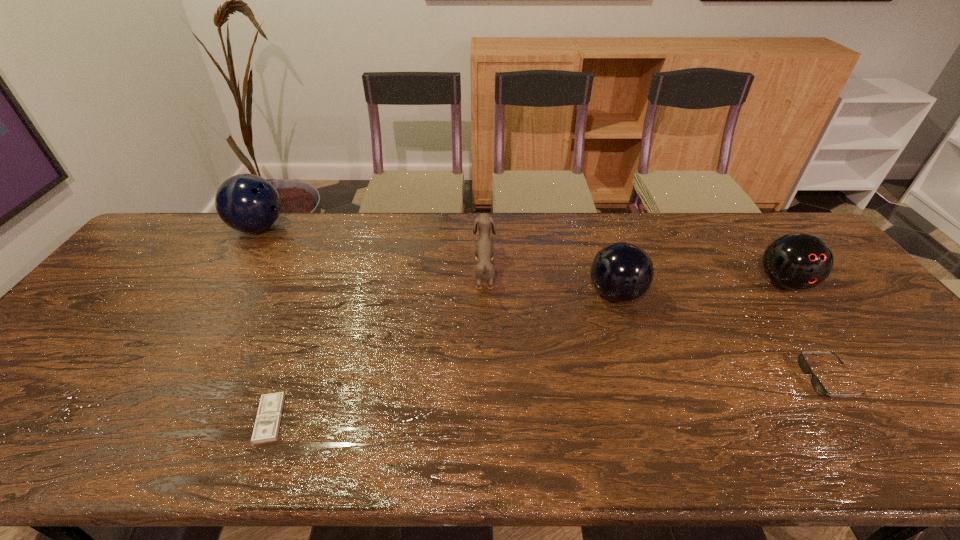
Identify which bowling ball is the nearest to the money. Please provide its 2D coordinates. Your answer should be formatted as a tuple, i.e. [(x, y)], where the tuple contains the x and y coordinates of a point satisfying the conditions above.

[(248, 203)]

Image resolution: width=960 pixels, height=540 pixels. In order to click on bowling ball that stands as the second closest to the third object from left to right in this screenshot , I will do `click(248, 203)`.

This screenshot has width=960, height=540. Identify the location of free spot that satisfies the following two spatial constraints: 1. on the side of the fourth object from left to right with the finger holes; 2. on the front side of the fifth object from right to left. (657, 419).

Identify the location of free space that satisfies the following two spatial constraints: 1. on the surface of the rightmost bowling ball near the finger holes; 2. on the side of the fourth object from left to right with the finger holes. Image resolution: width=960 pixels, height=540 pixels. (792, 294).

Locate an element on the screen. The image size is (960, 540). free space that satisfies the following two spatial constraints: 1. on the surface of the rightmost bowling ball near the finger holes; 2. on the front-facing side of the sunglasses is located at coordinates (856, 380).